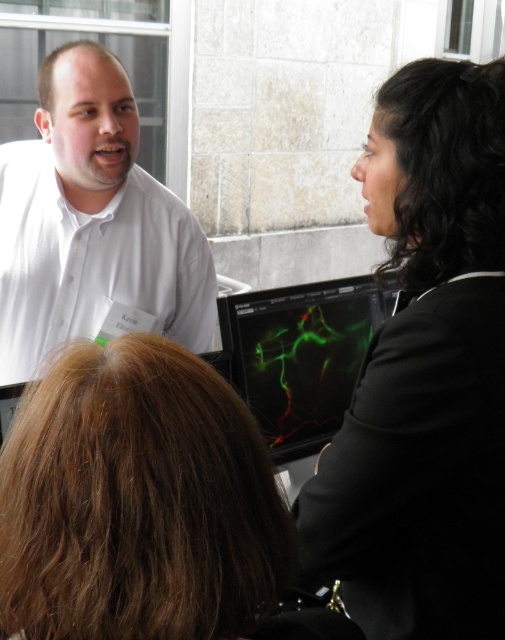
Question: Does black smooth suit at right have a lesser width compared to green matte screen at center?

Choices:
 (A) yes
 (B) no

Answer: (A)

Question: Which object is the closest to the white smooth shirt at upper left?

Choices:
 (A) green matte screen at center
 (B) black smooth suit at right
 (C) brown hair at center

Answer: (A)

Question: Does black smooth suit at right appear over brown hair at center?

Choices:
 (A) yes
 (B) no

Answer: (A)

Question: Which point is closer to the camera?

Choices:
 (A) green matte screen at center
 (B) black smooth suit at right
 (C) brown hair at center

Answer: (C)

Question: Does black smooth suit at right appear over green matte screen at center?

Choices:
 (A) no
 (B) yes

Answer: (B)

Question: Which object is farther from the camera taking this photo?

Choices:
 (A) green matte screen at center
 (B) white smooth shirt at upper left
 (C) black smooth suit at right
 (D) brown hair at center

Answer: (A)